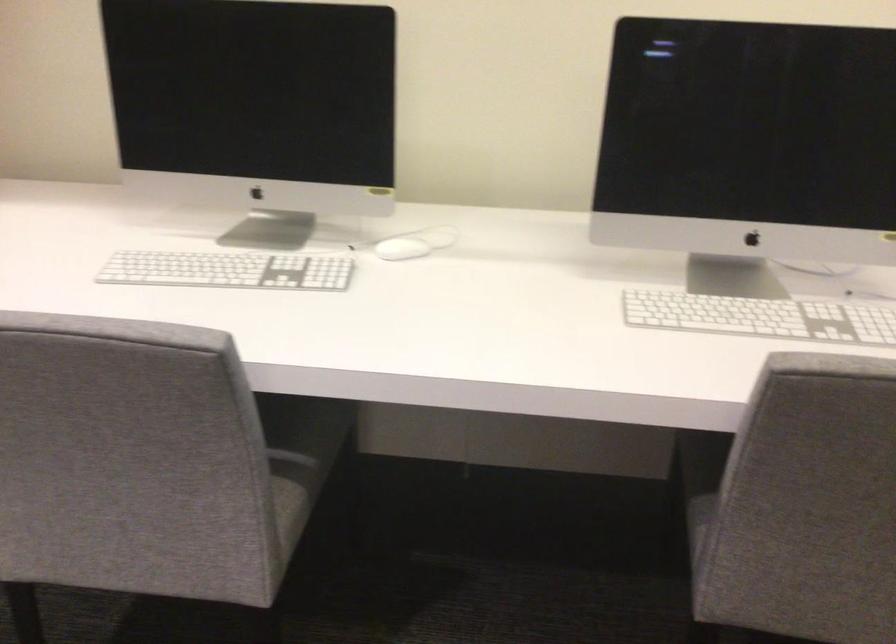
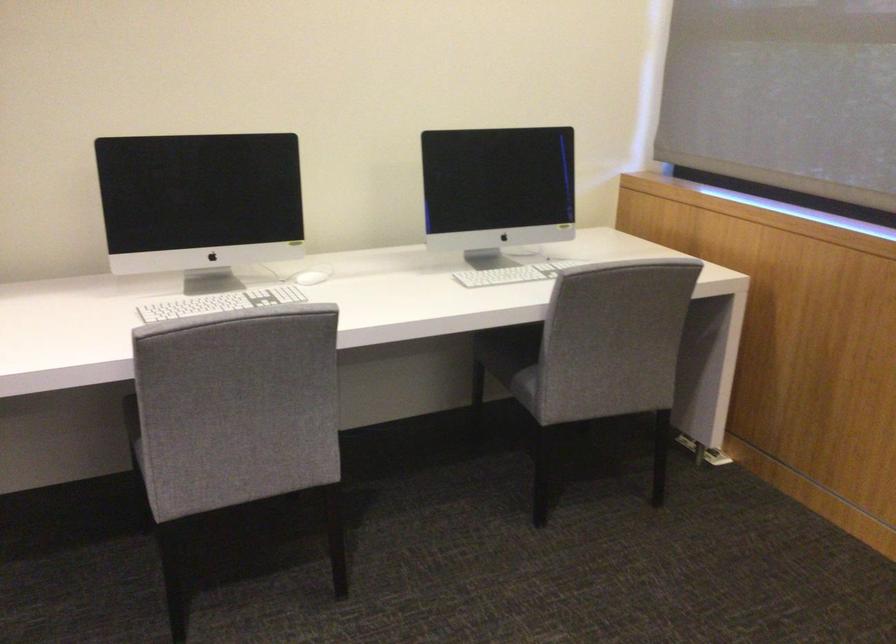
The point at (401, 249) is marked in the first image. Where is the corresponding point in the second image?

(307, 277)